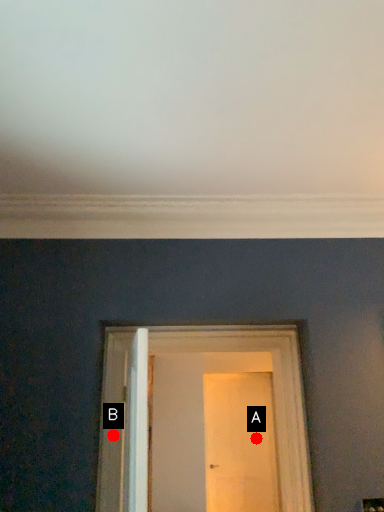
Question: Two points are circled on the image, labeled by A and B beside each circle. Which point appears farthest from the camera in this image?

Choices:
 (A) A is further
 (B) B is further

Answer: (A)